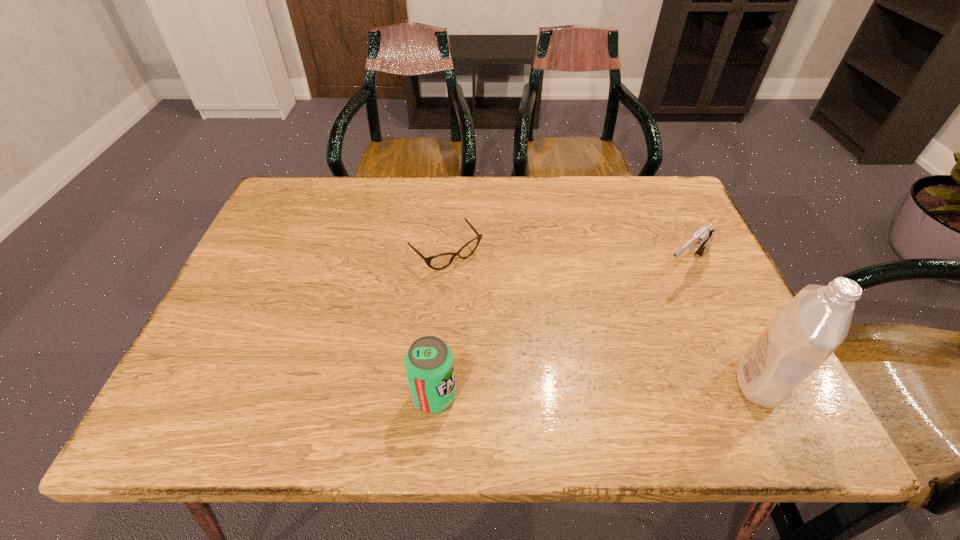
At what (x,y) coordinates should I click in order to perform the action: click on vacant space that's between the gun and the spectacles. Please return your answer as a coordinate pair (x, y). This screenshot has height=540, width=960. Looking at the image, I should click on (565, 260).

At what (x,y) coordinates should I click in order to perform the action: click on vacant area between the spectacles and the pop soda. Please return your answer as a coordinate pair (x, y). Looking at the image, I should click on (441, 325).

Point out which object is positioned as the second nearest to the shortest object. Please provide its 2D coordinates. Your answer should be formatted as a tuple, i.e. [(x, y)], where the tuple contains the x and y coordinates of a point satisfying the conditions above.

[(700, 242)]

Choose which object is the second nearest neighbor to the second tallest object. Please provide its 2D coordinates. Your answer should be formatted as a tuple, i.e. [(x, y)], where the tuple contains the x and y coordinates of a point satisfying the conditions above.

[(700, 242)]

Identify the location of blank space that satisfies the following two spatial constraints: 1. on the front side of the gun; 2. on the right side of the shortest object. (445, 267).

In order to click on free point that satisfies the following two spatial constraints: 1. on the front side of the tallest object; 2. on the right side of the shortest object in this screenshot , I will do `click(437, 381)`.

Where is `free space that satisfies the following two spatial constraints: 1. on the front side of the gun; 2. on the left side of the detergent`? free space that satisfies the following two spatial constraints: 1. on the front side of the gun; 2. on the left side of the detergent is located at coordinates (737, 381).